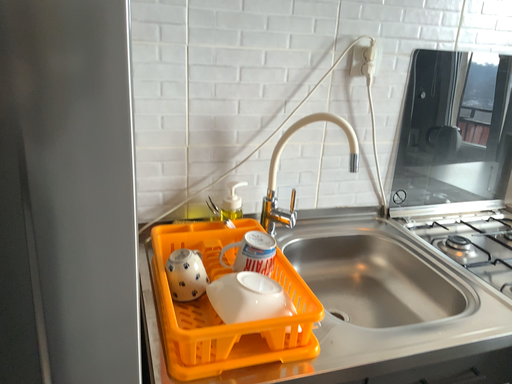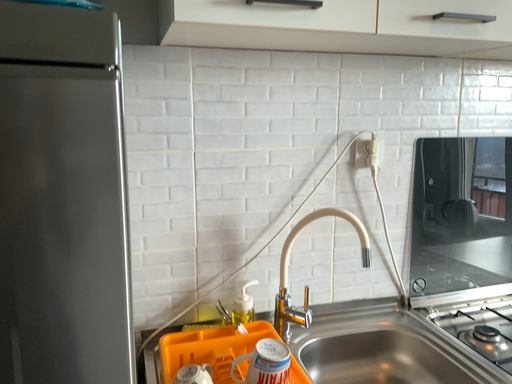
Question: Which way did the camera rotate in the video?

Choices:
 (A) rotated downward
 (B) rotated upward

Answer: (B)